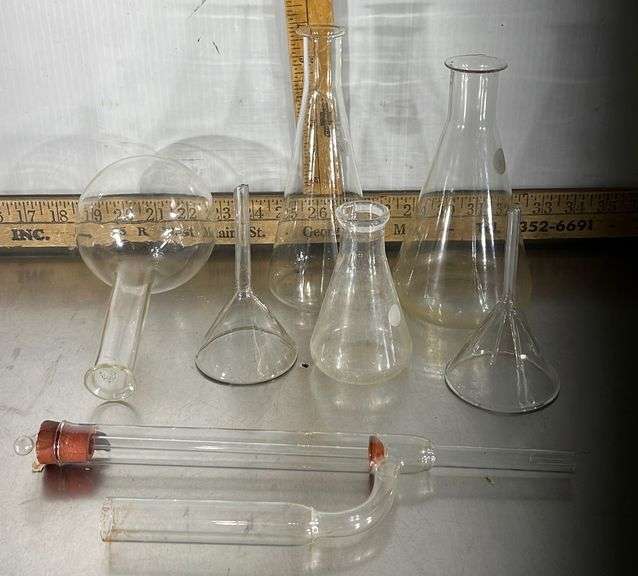
The width and height of the screenshot is (638, 576). Find the location of `flask`. flask is located at coordinates (164, 244).